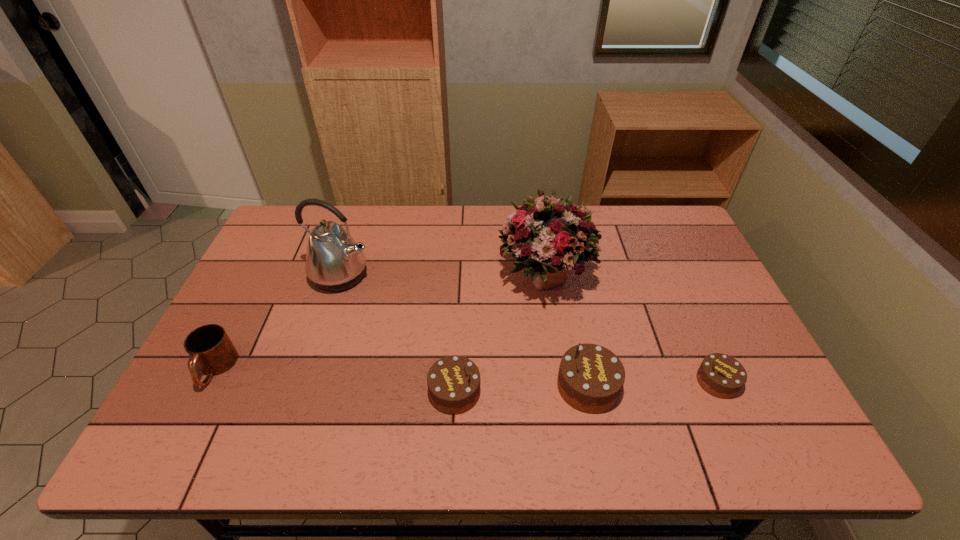
The image size is (960, 540). Find the location of `object situated at the near right corner`. object situated at the near right corner is located at coordinates (720, 375).

In the image, there is a desktop. Where is `vacant space at the far edge`? vacant space at the far edge is located at coordinates (471, 218).

Image resolution: width=960 pixels, height=540 pixels. Find the location of `free region at the right edge of the desktop`. free region at the right edge of the desktop is located at coordinates (701, 327).

Locate an element on the screen. free space at the far right corner of the desktop is located at coordinates (663, 228).

I want to click on vacant area between the second object from left to right and the rightmost object, so click(x=529, y=328).

I want to click on vacant space in between the kettle and the rightmost chocolate cake, so click(529, 328).

This screenshot has width=960, height=540. What are the coordinates of `vacant space that is in between the bouquet and the rightmost chocolate cake` in the screenshot? It's located at (631, 328).

Where is `vacant area that lies between the mug and the kettle`? The image size is (960, 540). vacant area that lies between the mug and the kettle is located at coordinates pyautogui.click(x=278, y=322).

This screenshot has height=540, width=960. Find the location of `free space between the second tallest chocolate cake and the bouquet`. free space between the second tallest chocolate cake and the bouquet is located at coordinates (499, 333).

The width and height of the screenshot is (960, 540). In order to click on vacant space that's between the second chocolate cake from left to right and the kettle in this screenshot , I will do `click(464, 331)`.